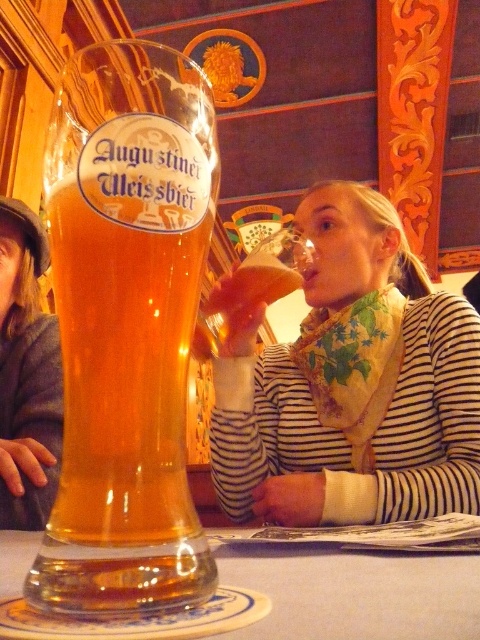
Does translucent glass beer glass at left have a lesser height compared to translucent glass at lower center?

No.

In the scene shown: Which of these two, translucent glass beer glass at left or translucent glass at lower center, stands taller?

With more height is translucent glass beer glass at left.

Where is `translucent glass beer glass at left`? This screenshot has width=480, height=640. translucent glass beer glass at left is located at coordinates (127, 326).

Is translucent glass beer glass at left below striped fabric scarf at upper center?

Actually, translucent glass beer glass at left is above striped fabric scarf at upper center.

Between point (199, 195) and point (238, 480), which one is positioned behind?

The point (238, 480) is behind.

Identify the location of translucent glass beer glass at left. This screenshot has width=480, height=640. (127, 326).

Is striped fabric scarf at upper center positioned at the back of translucent glass at lower center?

Yes, it is behind translucent glass at lower center.

Is striped fabric scarf at upper center taller than translucent glass at lower center?

Yes.

Is point (321, 412) positioned behind point (325, 577)?

Yes, point (321, 412) is behind point (325, 577).

What are the coordinates of `striped fabric scarf at upper center` in the screenshot? It's located at (352, 385).